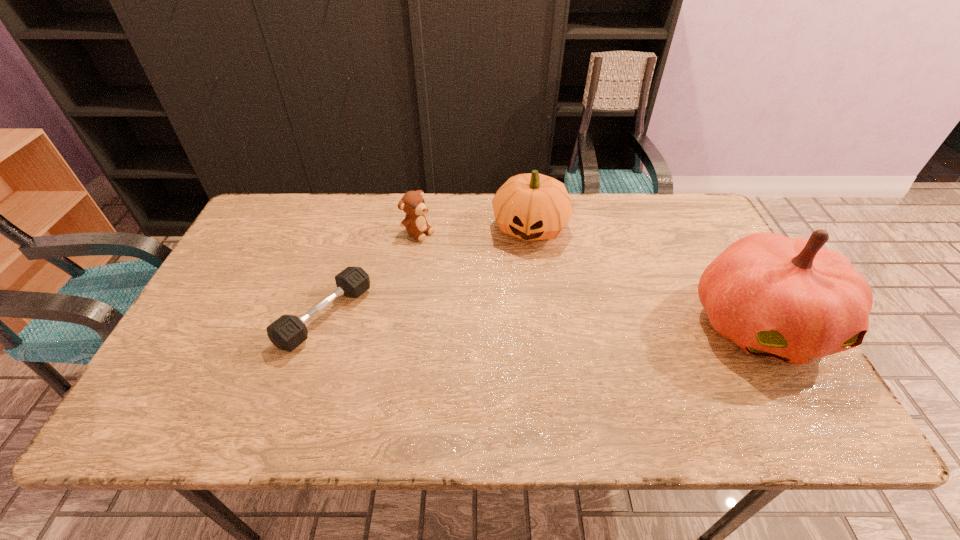
Where is `free region at the far edge of the desktop`? The height and width of the screenshot is (540, 960). free region at the far edge of the desktop is located at coordinates (350, 215).

Locate an element on the screen. This screenshot has width=960, height=540. free location at the near edge of the desktop is located at coordinates coord(631,373).

Locate an element on the screen. free space at the left edge is located at coordinates (245, 347).

Locate an element on the screen. The width and height of the screenshot is (960, 540). vacant space at the right edge is located at coordinates (690, 253).

Where is `free point at the far left corner`? free point at the far left corner is located at coordinates (262, 239).

At what (x,y) coordinates should I click in order to perform the action: click on vacant space at the near left corner of the desktop. Please return your answer as a coordinate pair (x, y). The height and width of the screenshot is (540, 960). Looking at the image, I should click on (169, 379).

This screenshot has width=960, height=540. Find the location of `empty space between the rightmost object and the shortest object`. empty space between the rightmost object and the shortest object is located at coordinates (543, 320).

Identify the location of empty space that is in between the shortest object and the second object from left to right. (372, 274).

Image resolution: width=960 pixels, height=540 pixels. In order to click on vacant area that lies between the third shortest object and the rightmost object in this screenshot , I will do `click(646, 275)`.

Image resolution: width=960 pixels, height=540 pixels. I want to click on empty location between the dumbbell and the gourd, so click(x=428, y=271).